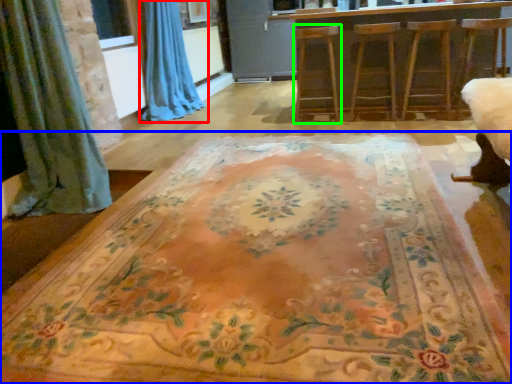
Question: Which object is the farthest from curtain (highlighted by a red box)? Choose among these: furniture (highlighted by a blue box) or armchair (highlighted by a green box).

Choices:
 (A) furniture
 (B) armchair

Answer: (A)